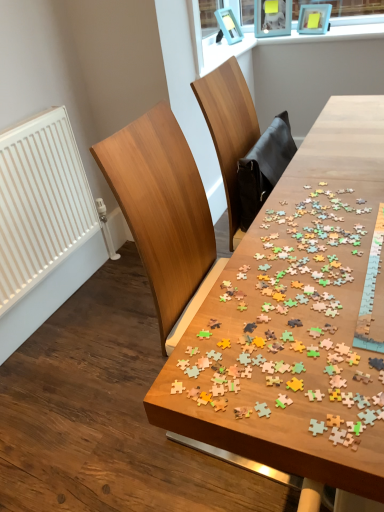
Find the location of a particular element. free area below white matte radiator at left (from a real-world perspective) is located at coordinates (69, 311).